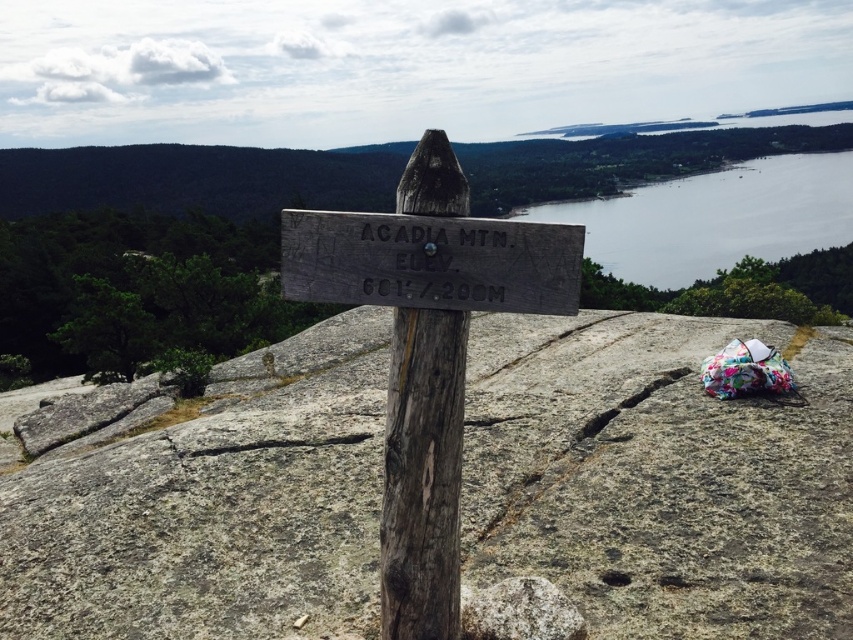
Looking at this image, is weathered wood sign at center wider than gray water at upper right?

No, weathered wood sign at center is not wider than gray water at upper right.

Which is behind, point (564, 246) or point (730, 248)?

The point (730, 248) is behind.

Find the location of a particular element. This screenshot has height=640, width=853. weathered wood sign at center is located at coordinates click(430, 260).

Can you confirm if gray rough rock at center is positioned below gray water at upper right?

Indeed, gray rough rock at center is positioned under gray water at upper right.

This screenshot has height=640, width=853. Identify the location of gray rough rock at center. (659, 476).

Between point (318, 477) and point (717, 172), which one is positioned behind?

Point (717, 172)

The width and height of the screenshot is (853, 640). I want to click on gray rough rock at center, so click(x=659, y=476).

Is weathered wood sign at center above white textured rock at center?

Yes.

Between weathered wood sign at center and white textured rock at center, which one is positioned higher?

weathered wood sign at center is higher up.

Locate an element on the screen. The image size is (853, 640). weathered wood sign at center is located at coordinates (430, 260).